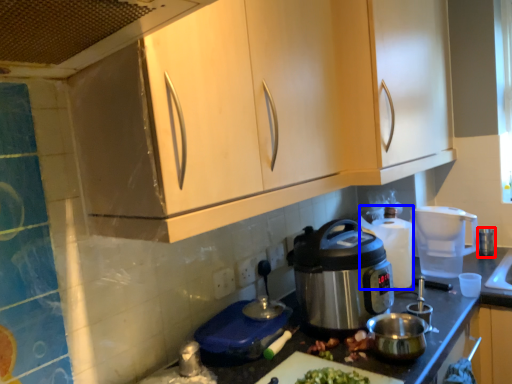
Question: Among these objects, which one is farthest to the camera, appliance (highlighted by a red box) or appliance (highlighted by a blue box)?

Choices:
 (A) appliance
 (B) appliance

Answer: (A)